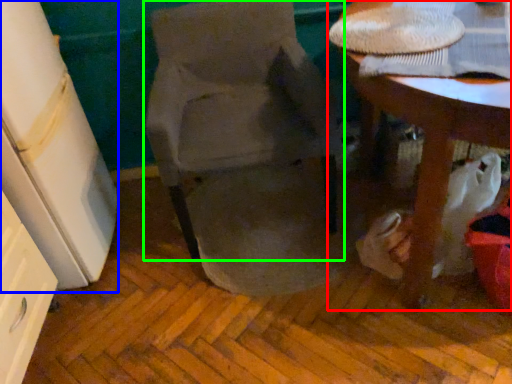
Question: Estimate the real-world distances between objects in this image. Which object is closer to table (highlighted by a red box), leftover (highlighted by a blue box) or chair (highlighted by a green box)?

Choices:
 (A) leftover
 (B) chair

Answer: (B)